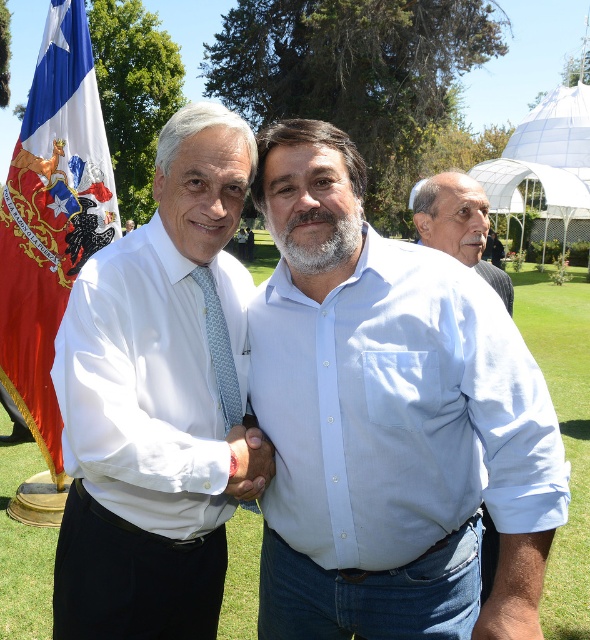
Which is behind, point (84, 195) or point (417, 196)?

Point (84, 195)

The width and height of the screenshot is (590, 640). What do you see at coordinates (51, 216) in the screenshot? I see `red-white-blue fabric flag at left` at bounding box center [51, 216].

Between point (37, 323) and point (476, 257), which one is positioned in front?

Point (476, 257)

Identify the location of red-white-blue fabric flag at left. This screenshot has height=640, width=590. (51, 216).

Can you confirm if white cotton shirt at center is positioned above gray/bearded man at center?

Actually, white cotton shirt at center is below gray/bearded man at center.

Who is more forward, (x=369, y=244) or (x=301, y=212)?

Point (x=301, y=212) is more forward.

Find the location of a particular element. The width and height of the screenshot is (590, 640). white cotton shirt at center is located at coordinates pos(394,445).

Between point (368, 284) and point (217, 371), which one is positioned in front?

Point (368, 284) is in front.

Which is above, white cotton shirt at center or light blue patterned tie at center?

light blue patterned tie at center is above.

Who is more forward, [388,316] or [230,368]?

Point [388,316] is in front.

I want to click on white cotton shirt at center, so click(394, 445).